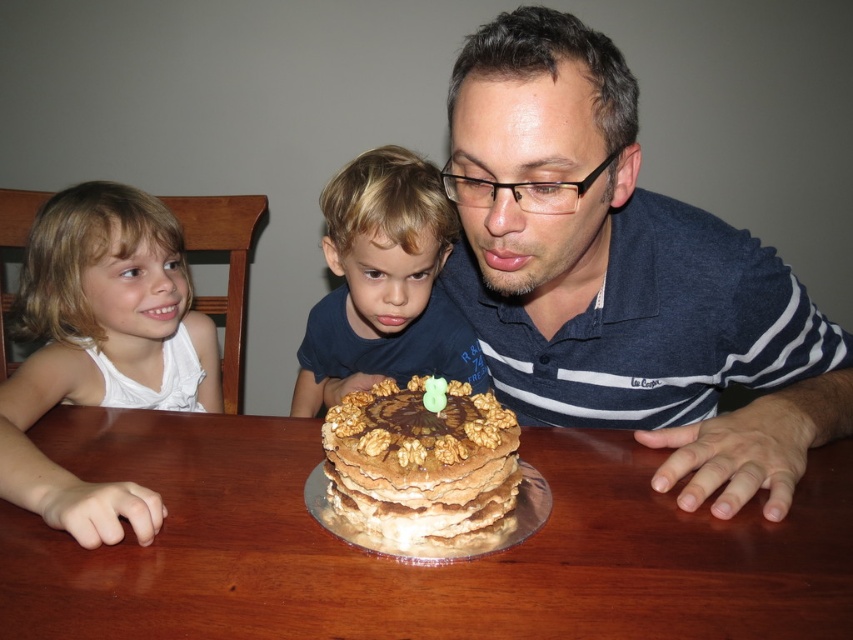
You are sitting at the brown wooden table at center and want to hand a napkin to the person wearing the matte blue shirt at center. Since both are at the center, how do you reach them?

The brown wooden table at center is closer to the viewer than the matte blue shirt at center, so you can reach the person by extending your arm across the table towards them.